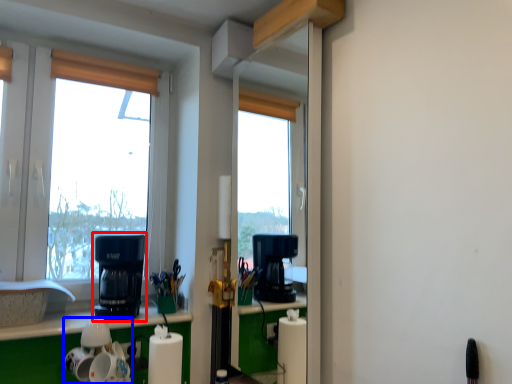
Question: Among these objects, which one is nearest to the camera, kitchen appliance (highlighted by a red box) or appliance (highlighted by a blue box)?

Choices:
 (A) kitchen appliance
 (B) appliance

Answer: (B)